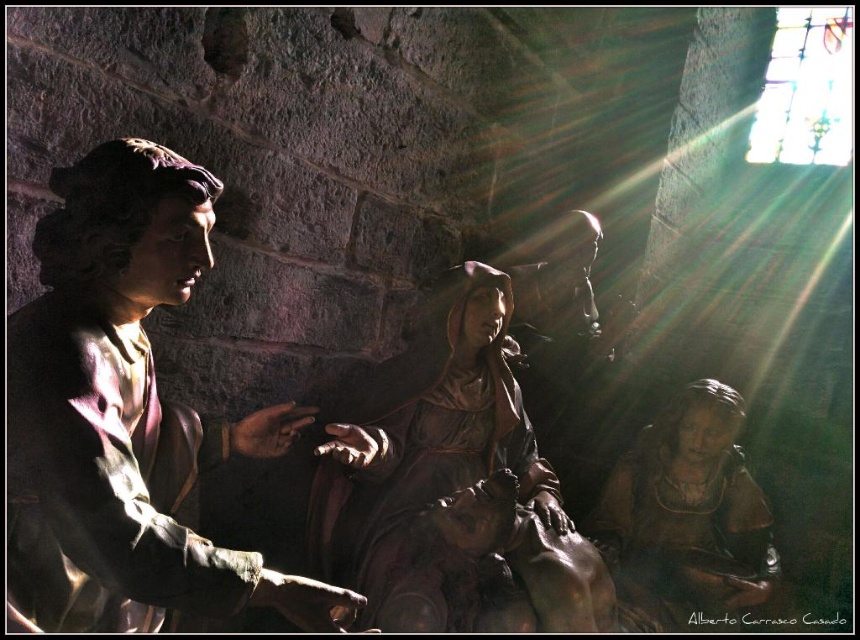
You are an art conservator assessing the placement of two statues in a stone chamber. The scene includes a matte bronze statue at left and a brown polished wood statue at center. Based on their positions, which statue is positioned higher up in the space?

The matte bronze statue at left is positioned higher up in the space than the brown polished wood statue at center.

You are an art conservator tasked with moving the statues to a new exhibition space. The matte bronze statue at left and the brown matte statue at lower right need to be placed on a platform that can only hold one of them. Which statue should you choose based on size?

The matte bronze statue at left is bigger than the brown matte statue at lower right, so you should choose the matte bronze statue at left to place on the platform since it requires more space.